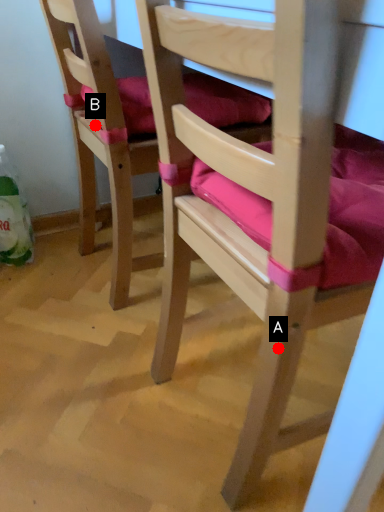
Question: Two points are circled on the image, labeled by A and B beside each circle. Which point appears closest to the camera in this image?

Choices:
 (A) A is closer
 (B) B is closer

Answer: (A)